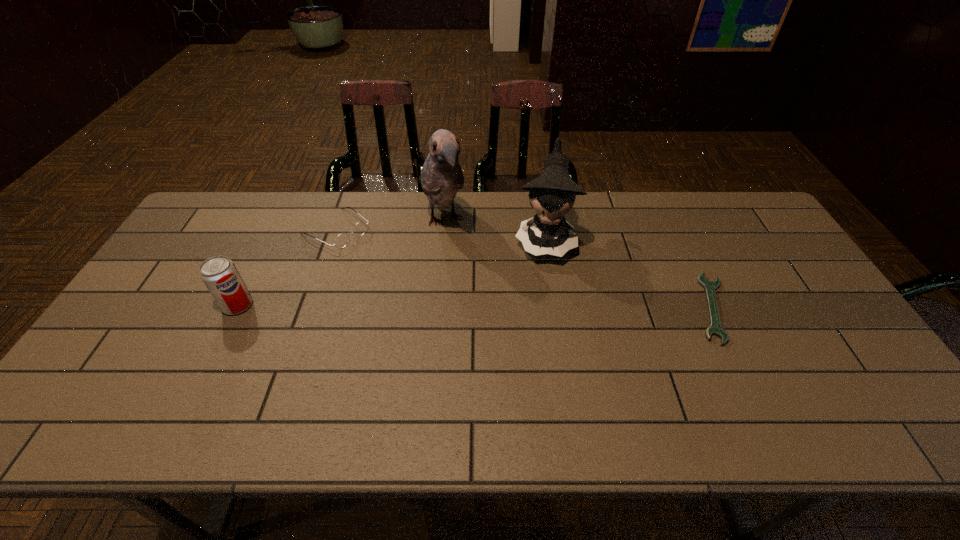
This screenshot has height=540, width=960. Find the location of `vacant region located on the front-facing side of the third object from right to left`. vacant region located on the front-facing side of the third object from right to left is located at coordinates (459, 273).

Find the location of a particular element. This screenshot has width=960, height=540. doll that is at the far edge is located at coordinates (553, 193).

Locate an element on the screen. This screenshot has width=960, height=540. spectacles located at the far edge is located at coordinates (342, 239).

I want to click on parrot at the far edge, so click(x=441, y=176).

In the image, there is a desktop. What are the coordinates of `vacant area at the far edge` in the screenshot? It's located at (653, 224).

Find the location of `vacant region at the near edge of the desktop`. vacant region at the near edge of the desktop is located at coordinates (338, 396).

You are a GUI agent. You are given a task and a screenshot of the screen. Output one action in this format:
    pyautogui.click(x=<x>, y=<y>)
    Task: Click on the free location at the left edge
    
    Given the screenshot: What is the action you would take?
    pyautogui.click(x=146, y=343)

In the image, there is a desktop. Identify the location of free space at the far left corner. The height and width of the screenshot is (540, 960). (204, 232).

This screenshot has width=960, height=540. In the image, there is a desktop. Find the location of `vacant space at the far right corner`. vacant space at the far right corner is located at coordinates (712, 209).

Locate an element on the screen. Image resolution: width=960 pixels, height=540 pixels. free point at the near right corner is located at coordinates pos(823,366).